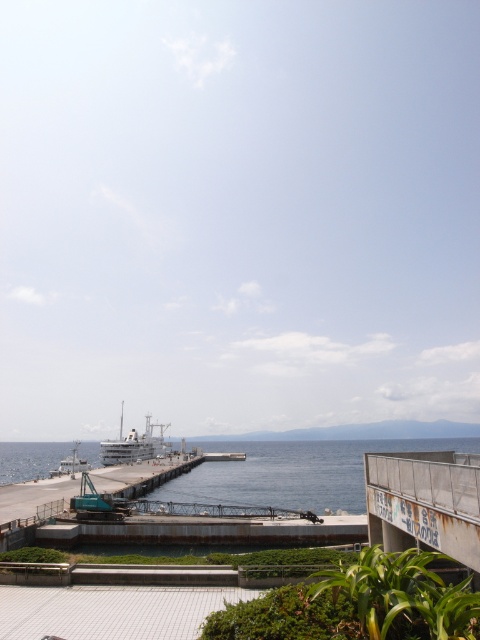
Does blue water at lower left have a lesser height compared to white matte ship at lower left?

In fact, blue water at lower left may be taller than white matte ship at lower left.

Who is more forward, (12, 477) or (129, 460)?

Point (129, 460)

You are a GUI agent. You are given a task and a screenshot of the screen. Output one action in this format:
    pyautogui.click(x=<x>, y=<y>)
    Task: Click on the blue water at lower left
    
    Given the screenshot: What is the action you would take?
    pyautogui.click(x=295, y=472)

The height and width of the screenshot is (640, 480). Find the location of `blue water at lower left`. blue water at lower left is located at coordinates coord(295,472).

Locate an element on the screen. rusty metal dock at lower right is located at coordinates (424, 502).

In the scene shown: Is blue water at lower left further to camera compared to rusty metal dock at lower right?

Yes, blue water at lower left is further from the viewer.

At what (x,y) coordinates should I click in order to perform the action: click on blue water at lower left. Please return your answer as a coordinate pair (x, y). Image resolution: width=480 pixels, height=640 pixels. Looking at the image, I should click on (295, 472).